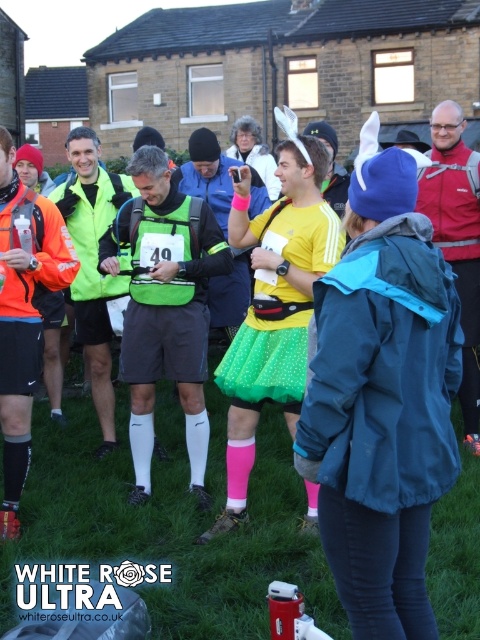
Is green polka dot skirt at center smaller than green matte vest at center?

Correct, green polka dot skirt at center occupies less space than green matte vest at center.

Does green polka dot skirt at center appear on the left side of green matte vest at center?

In fact, green polka dot skirt at center is to the right of green matte vest at center.

Is point (347, 422) positioned behind point (197, 344)?

No.

In order to click on green polka dot skirt at center in this screenshot , I will do `click(382, 403)`.

From the picture: Between green polka dot skirt at center and green tulle skirt at center, which one is positioned higher?

Positioned higher is green tulle skirt at center.

Who is positioned more to the left, green polka dot skirt at center or green tulle skirt at center?

Positioned to the left is green tulle skirt at center.

Does point (368, 433) come farther from viewer compared to point (296, 280)?

No, (368, 433) is closer to viewer.

Image resolution: width=480 pixels, height=640 pixels. I want to click on green polka dot skirt at center, so click(x=382, y=403).

Can you confirm if green tulle skirt at center is thinner than green matte vest at center?

Indeed, green tulle skirt at center has a lesser width compared to green matte vest at center.

Between green tulle skirt at center and green matte vest at center, which one is positioned lower?

Positioned lower is green tulle skirt at center.

Which is behind, point (264, 324) or point (215, 240)?

Positioned behind is point (215, 240).

At what (x,y) coordinates should I click in order to perform the action: click on green tulle skirt at center. Please return your answer as a coordinate pair (x, y). This screenshot has width=480, height=640. Looking at the image, I should click on (274, 307).